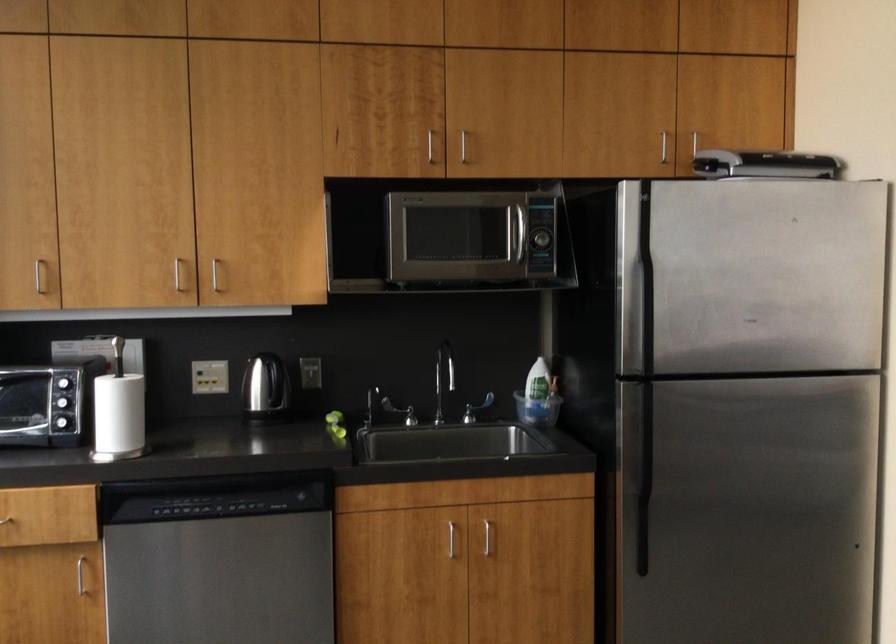
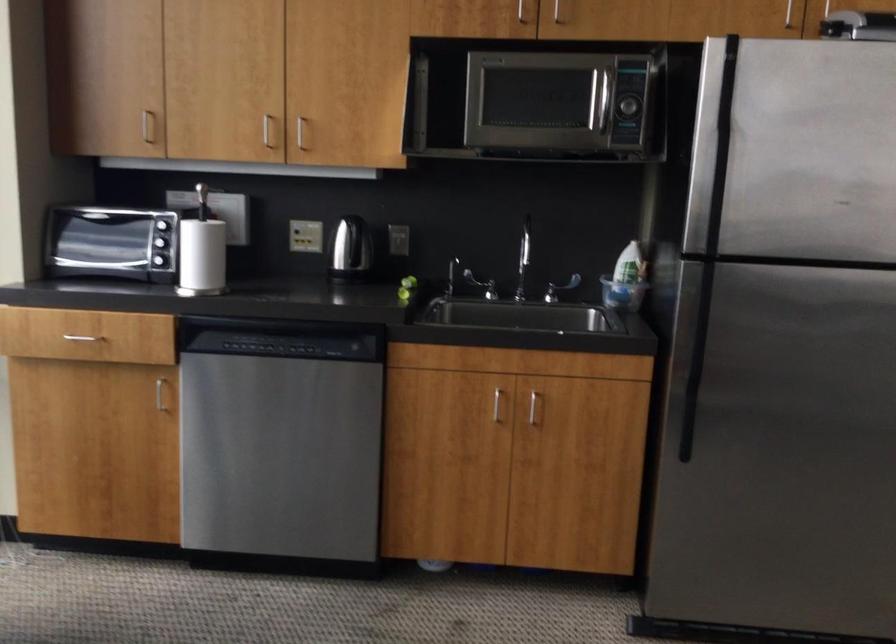
Locate, in the second image, the point that corresponds to the point at 648,310 in the first image.

(718, 184)